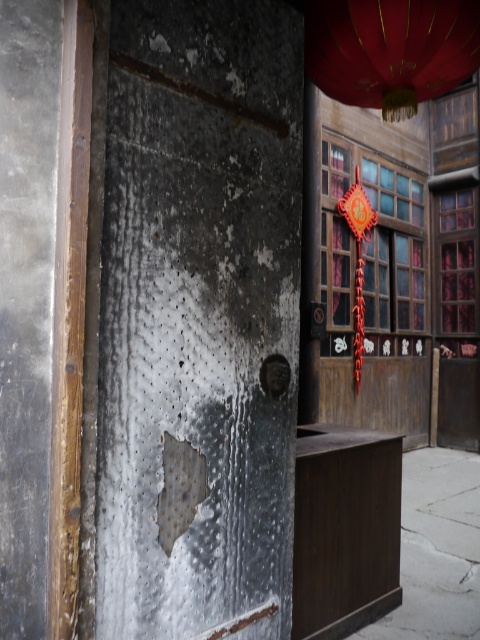
You are standing in front of the aged building shown in the image. There is a point at coordinates (x=199, y=317). What object is located at this point?

The point at coordinates (x=199, y=317) corresponds to the rusty metal door at center.

You are standing in front of the aged building and want to hang a new decorative item. If you want to place it to the right of the rusty metal door at center, where should you place it relative to the shiny red paper lantern at upper center?

The rusty metal door at center is to the left of the shiny red paper lantern at upper center. Therefore, placing the new decorative item to the right of the rusty metal door at center would mean placing it to the left of the shiny red paper lantern at upper center.

You are a painter standing at the entrance of the building. You need to paint both the rusty metal door at center and the shiny red paper lantern at upper center. Which object is closer to you?

The rusty metal door at center is closer to you because it is located at the center, while the shiny red paper lantern at upper center is positioned higher up, making it farther away.